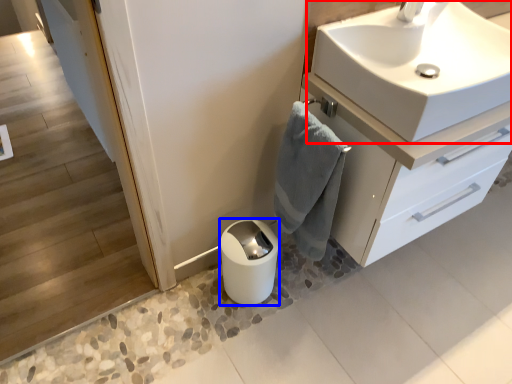
Question: Which object appears closest to the camera in this image, sink (highlighted by a red box) or toilet paper (highlighted by a blue box)?

Choices:
 (A) sink
 (B) toilet paper

Answer: (A)